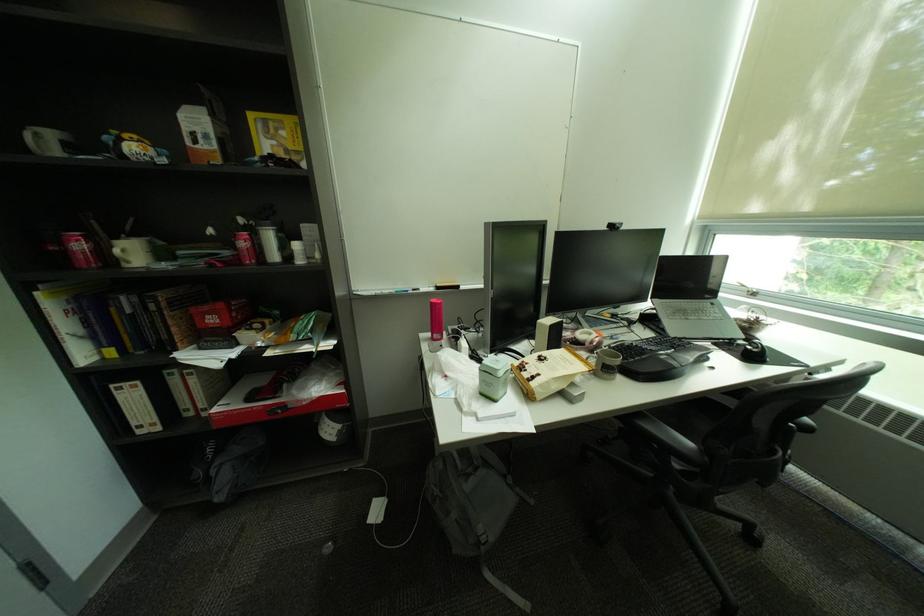
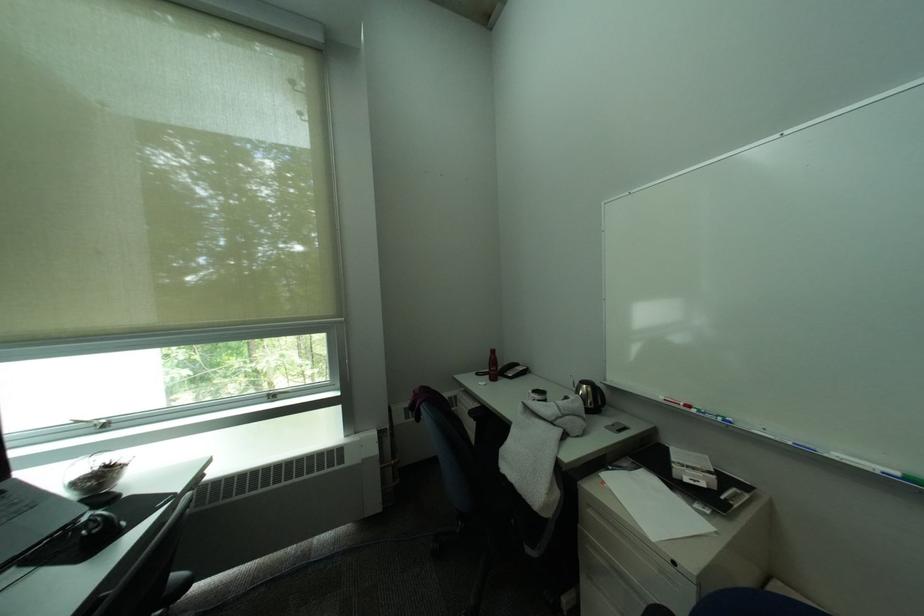
Locate, in the second image, the point that corresponds to point (767, 350) in the first image.

(106, 528)